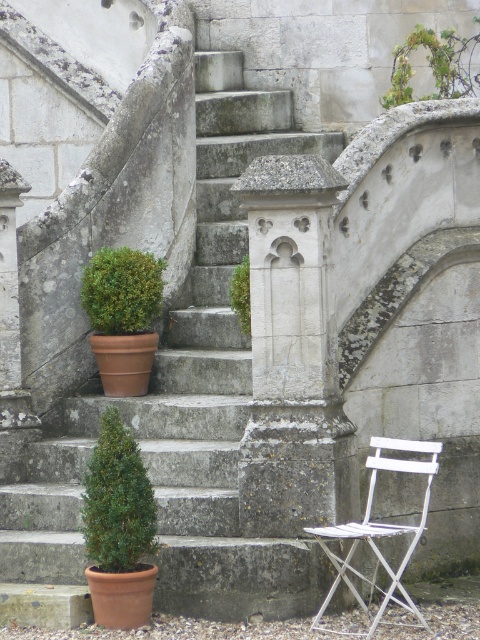
You are standing at the bottom of the smooth stone stairs at center and want to reach the green leafy plant at upper center. Which direction should you move to get closer to the plant?

To reach the green leafy plant at upper center, you should move upward along the smooth stone stairs at center since the plant is located further away from you than the stairs.

You are standing at the bottom of the outdoor stone staircase and want to place a small potted plant between the green matte hedge at lower left and the white painted wood chair at lower right. Based on their positions, where should you place the potted plant to ensure it is between them?

The green matte hedge at lower left is located above the white painted wood chair at lower right. To place the potted plant between them, position it below the green matte hedge at lower left and above the white painted wood chair at lower right.

You are standing at the bottom of the staircase and want to walk towards the building entrance. There are two green objects in your view, the green matte hedge at lower left and the green mossy stone column at center. Which one is closer to your left side as you face the staircase?

The green matte hedge at lower left is positioned on the left side of the green mossy stone column at center, so as you face the staircase, the green matte hedge at lower left is closer to your left side.